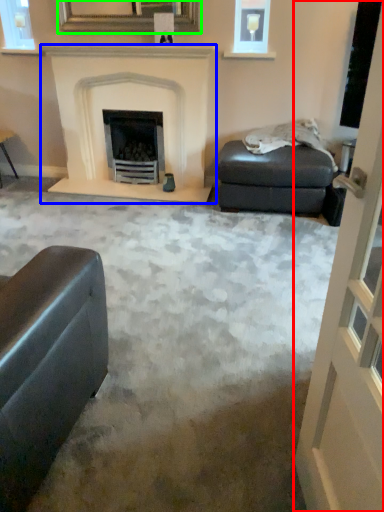
Question: Based on their relative distances, which object is farther from screen door (highlighted by a red box)? Choose from fireplace (highlighted by a blue box) and picture frame (highlighted by a green box).

Choices:
 (A) fireplace
 (B) picture frame

Answer: (B)